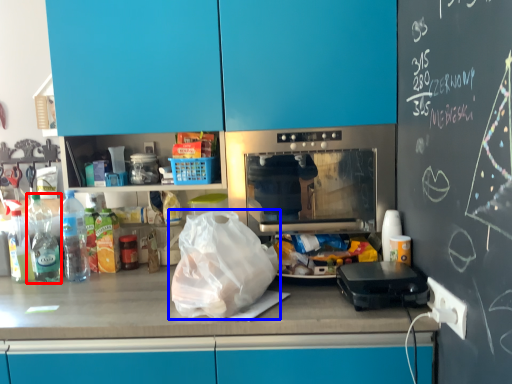
Question: Which object appears farthest to the camera in this image, bottle (highlighted by a red box) or plastic bag (highlighted by a blue box)?

Choices:
 (A) bottle
 (B) plastic bag

Answer: (A)